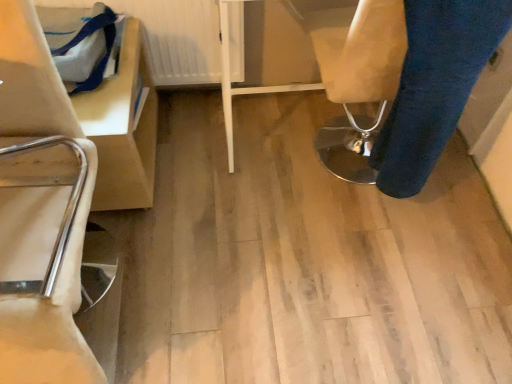
Question: Considering the relative sizes of white textured radiator at upper left and blue denim trousers at lower right in the image provided, is white textured radiator at upper left taller than blue denim trousers at lower right?

Choices:
 (A) yes
 (B) no

Answer: (B)

Question: Considering the relative sizes of white textured radiator at upper left and blue denim trousers at lower right in the image provided, is white textured radiator at upper left bigger than blue denim trousers at lower right?

Choices:
 (A) yes
 (B) no

Answer: (B)

Question: From the image's perspective, is white textured radiator at upper left under blue denim trousers at lower right?

Choices:
 (A) no
 (B) yes

Answer: (A)

Question: Is blue denim trousers at lower right a part of white textured radiator at upper left?

Choices:
 (A) no
 (B) yes

Answer: (A)

Question: From the image's perspective, is white textured radiator at upper left over blue denim trousers at lower right?

Choices:
 (A) yes
 (B) no

Answer: (A)

Question: Does white textured radiator at upper left turn towards blue denim trousers at lower right?

Choices:
 (A) yes
 (B) no

Answer: (B)

Question: Is blue denim trousers at lower right facing towards white textured radiator at upper left?

Choices:
 (A) yes
 (B) no

Answer: (B)

Question: Can you confirm if blue denim trousers at lower right is bigger than white textured radiator at upper left?

Choices:
 (A) yes
 (B) no

Answer: (A)

Question: Is blue denim trousers at lower right to the right of white textured radiator at upper left from the viewer's perspective?

Choices:
 (A) yes
 (B) no

Answer: (A)

Question: Is white textured radiator at upper left completely or partially inside blue denim trousers at lower right?

Choices:
 (A) no
 (B) yes

Answer: (A)

Question: From the image's perspective, is blue denim trousers at lower right below white textured radiator at upper left?

Choices:
 (A) no
 (B) yes

Answer: (B)

Question: Is blue denim trousers at lower right smaller than white textured radiator at upper left?

Choices:
 (A) no
 (B) yes

Answer: (A)

Question: Is point (403, 168) positioned closer to the camera than point (241, 24)?

Choices:
 (A) closer
 (B) farther

Answer: (A)